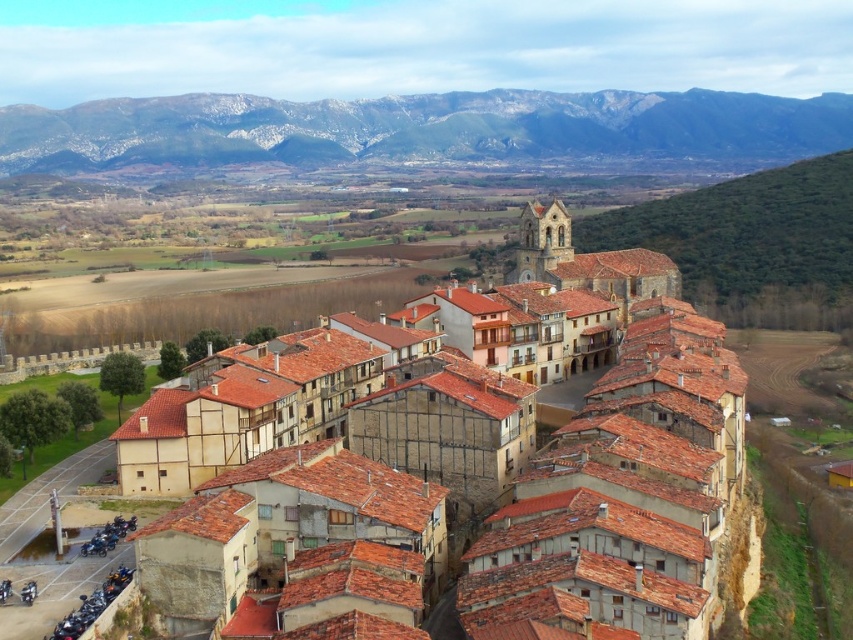
You are an architect designing a new building in the town. You need to ensure that the new building won not block the view of the gray rocky mountain at upper center from the brown clay roof tiles at center. Based on their positions, which object is located to the right of the other?

The brown clay roof tiles at center is positioned on the right side of gray rocky mountain at upper center, so the brown clay roof tiles at center is to the right of the gray rocky mountain at upper center.

You are an architect designing a new building in the town. You need to ensure that the new building does not block the view of the gray rocky mountain at upper center from the brown clay roof tiles at center. Based on their current sizes, which object is narrower and would allow the mountain to remain visible?

The brown clay roof tiles at center is thinner than the gray rocky mountain at upper center, so the brown clay roof tiles at center are narrower. This means the new building could be placed near the brown clay roof tiles at center without obstructing the view of the mountain.